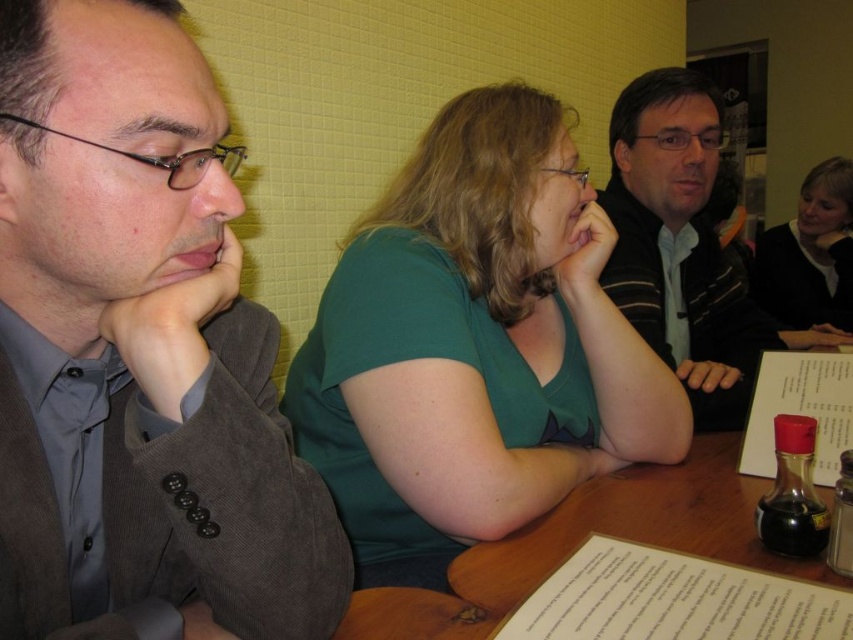
Who is lower down, green matte shirt at center or black sweater at upper right?

green matte shirt at center is below.

Does green matte shirt at center come behind black sweater at upper right?

No, green matte shirt at center is in front of black sweater at upper right.

The width and height of the screenshot is (853, 640). Identify the location of green matte shirt at center. (474, 346).

Can you confirm if matte gray suit at left is taller than striped sweater at center?

No, matte gray suit at left is not taller than striped sweater at center.

Is point (231, 454) behind point (685, 77)?

No.

The image size is (853, 640). Identify the location of matte gray suit at left. (138, 353).

Does green matte shirt at center appear on the left side of white paper menu at lower right?

Yes, green matte shirt at center is to the left of white paper menu at lower right.

Who is higher up, green matte shirt at center or white paper menu at lower right?

green matte shirt at center is higher up.

Between point (625, 371) and point (814, 401), which one is positioned behind?

Point (625, 371)

Identify the location of green matte shirt at center. (474, 346).